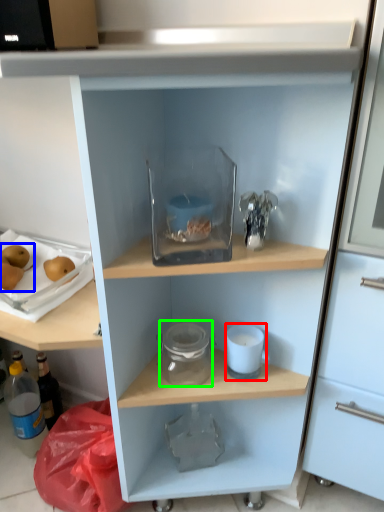
Question: Considering the real-world distances, which object is closest to appliance (highlighted by a red box)? fruit (highlighted by a blue box) or glass jar (highlighted by a green box).

Choices:
 (A) fruit
 (B) glass jar

Answer: (B)